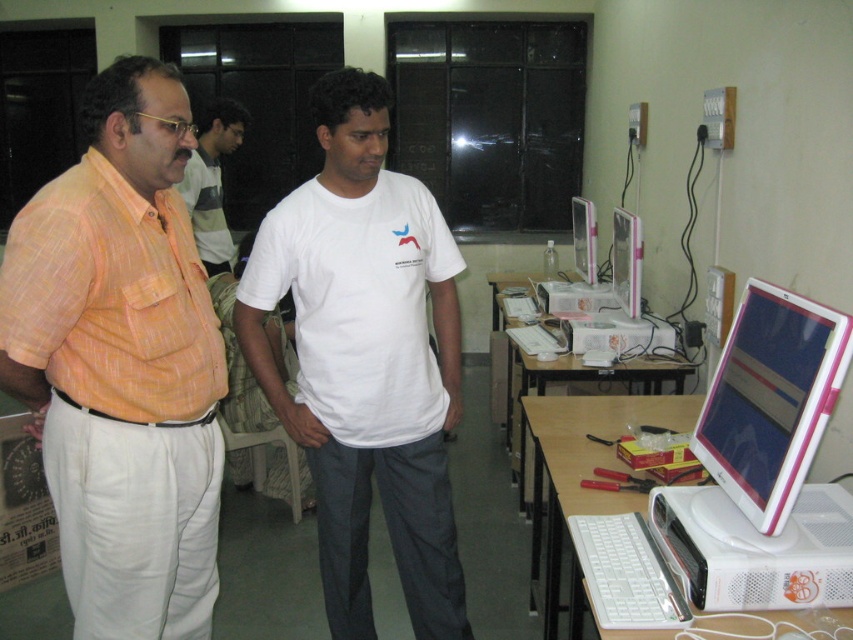
You are setting up a new workstation in the computer lab. You have a pink plastic monitor at center right and a white plastic desktop at lower right. Which object is bigger?

The pink plastic monitor at center right is larger than the white plastic desktop at lower right according to the description.

You are a student in the computer lab and need to reach both the point at coordinates (160, 237) and the point at (744, 403). Which point should you move towards first if you want to reach the closer one first?

You should move towards point (160, 237) first because it is closer to you than point (744, 403).